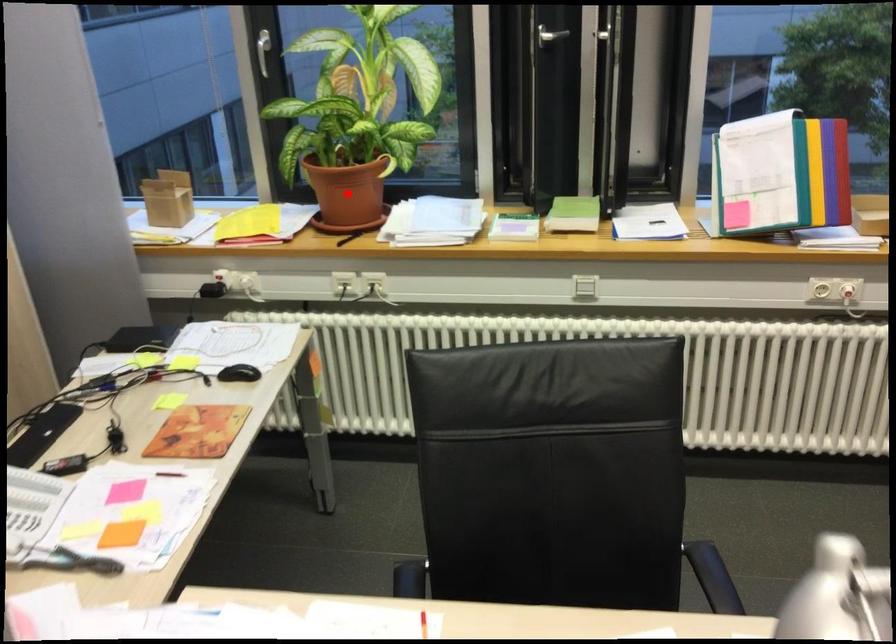
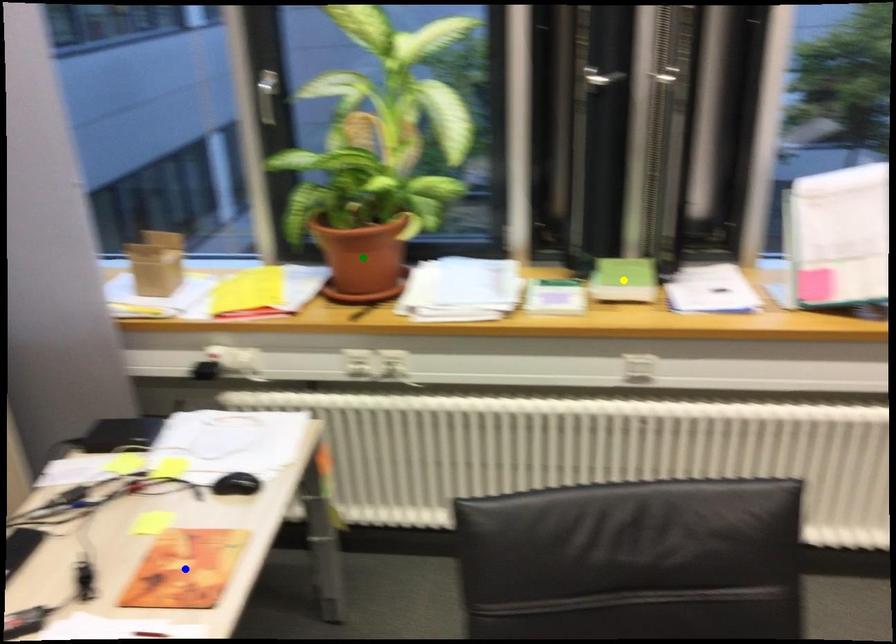
Question: I am providing you with two images of the same scene from different viewpoints. A red point is marked on the first image. You are given multiple points on the second image. Can you choose the point in image 2 that corresponds to the point in image 1?

Choices:
 (A) blue point
 (B) yellow point
 (C) green point

Answer: (C)